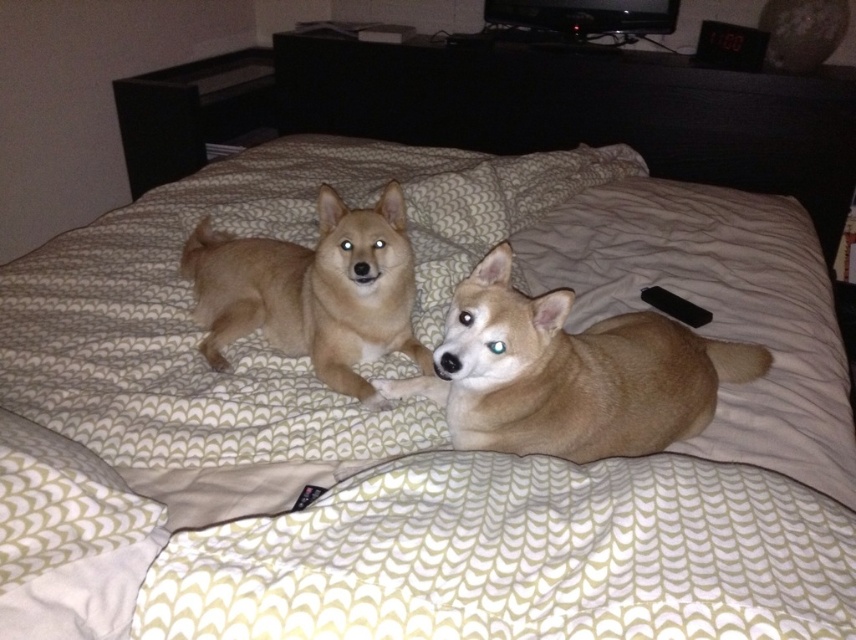
You are a photographer trying to capture a photo of both the fuzzy beige dog at center and the sandy fur dog at center. Since you want them to appear side by side in the frame, which dog should you move to the left to make space?

The fuzzy beige dog at center is on the right side of the sandy fur dog at center, so you should move the fuzzy beige dog at center to the left to make space.

You are a drone operator trying to place a small package on the bed where the two dogs are resting. The package must be placed exactly between the two points on the bed marked as point (632, 323) and point (342, 212). Considering the dogs are occupying the space, will the package be closer to the dog in front or the dog behind?

The package placed exactly between point (632, 323) and point (342, 212) will be closer to the dog in front because point (632, 323) is closer to the viewer than point (342, 212).

You are trying to fit both the fuzzy beige dog at center and the sandy fur dog at center onto a narrow bench that can only accommodate one dog at a time. Based on their sizes, which dog would you choose to sit first to ensure both can fit?

The sandy fur dog at center is narrower, so you should sit it first to make space for the fuzzy beige dog at center.